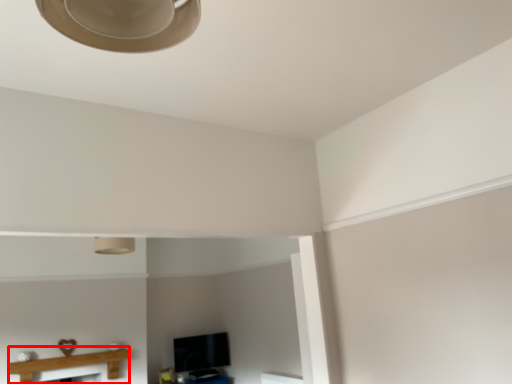
Question: In this image, where is table (annotated by the red box) located relative to lamp?

Choices:
 (A) left
 (B) right

Answer: (A)